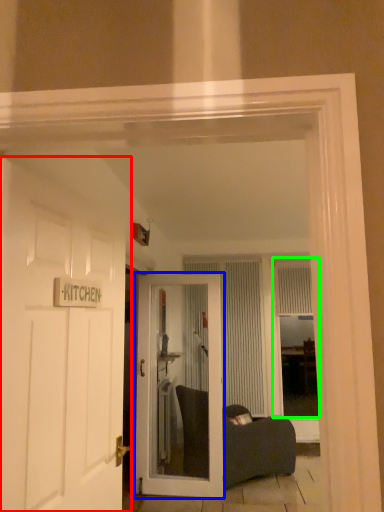
Question: Based on their relative distances, which object is nearer to door (highlighted by a red box)? Choose from door (highlighted by a blue box) and window (highlighted by a green box).

Choices:
 (A) door
 (B) window

Answer: (A)